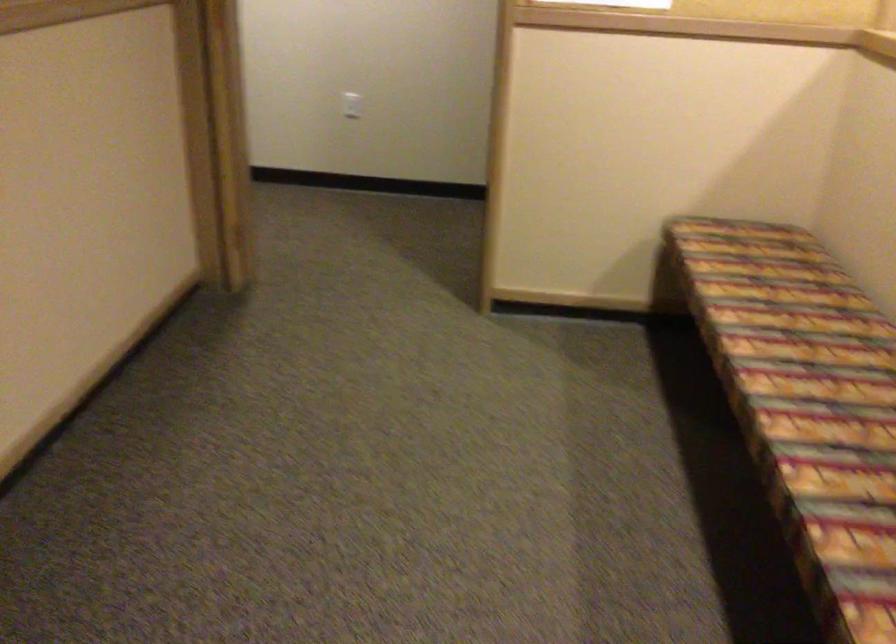
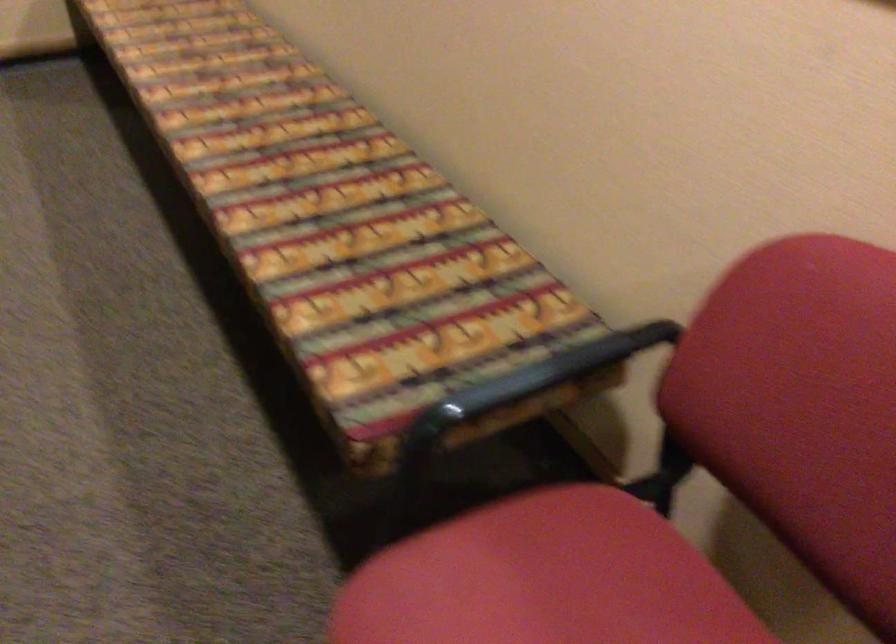
The first image is from the beginning of the video and the second image is from the end. How did the camera likely rotate when shooting the video?

The camera's rotation is toward right-down.